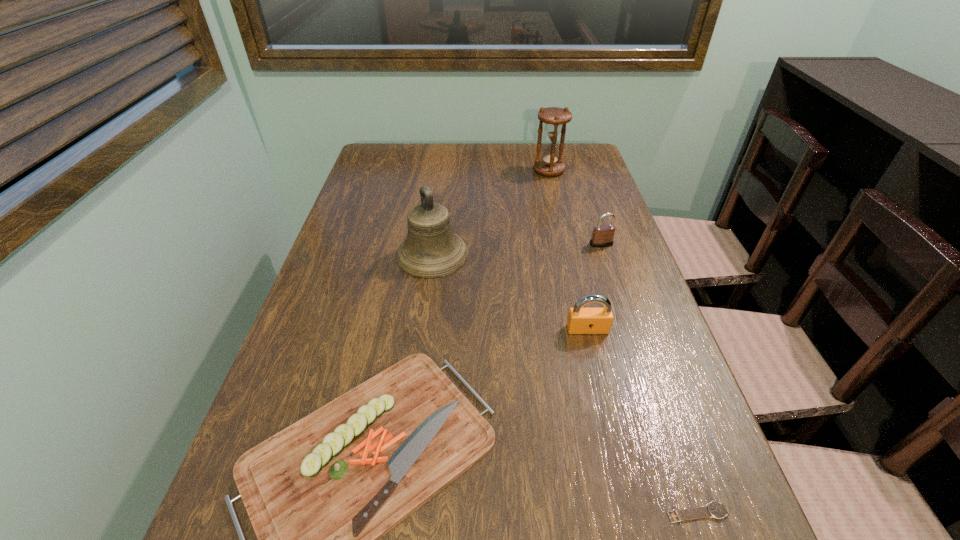
Locate an element on the screen. Image resolution: width=960 pixels, height=540 pixels. hourglass is located at coordinates (550, 164).

The image size is (960, 540). Identify the location of bell. (431, 250).

I want to click on the nearer padlock, so click(581, 320).

What are the coordinates of `the left padlock` in the screenshot? It's located at (581, 320).

Identify the location of the right padlock. (602, 236).

The height and width of the screenshot is (540, 960). What are the coordinates of `the shortest object` in the screenshot? It's located at (714, 509).

The height and width of the screenshot is (540, 960). What are the coordinates of `vacant space located on the front of the farthest object` in the screenshot? It's located at (554, 194).

Find the location of `free space located on the front of the bell`. free space located on the front of the bell is located at coordinates (427, 300).

What are the coordinates of `vacant region located 0.130m to unlock the nearer padlock from the front` in the screenshot? It's located at (602, 389).

Where is `vacant space situated on the left of the farther padlock`? This screenshot has height=540, width=960. vacant space situated on the left of the farther padlock is located at coordinates (518, 244).